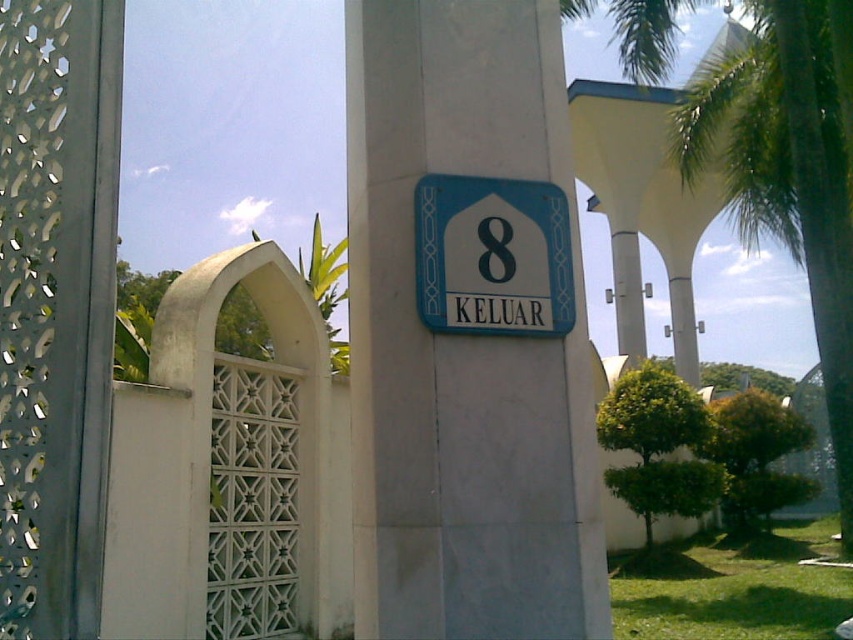
At what (x,y) coordinates should I click in order to perform the action: click on green leafy palm tree at right. Please return your answer as a coordinate pair (x, y). Looking at the image, I should click on (788, 180).

Is green leafy palm tree at right to the left of blue plastic sign at center from the viewer's perspective?

In fact, green leafy palm tree at right is to the right of blue plastic sign at center.

I want to click on green leafy palm tree at right, so click(x=788, y=180).

Is white smooth pillar at center positioned behind green leafy palm tree at right?

No, it is in front of green leafy palm tree at right.

From the picture: Can you confirm if white smooth pillar at center is thinner than green leafy palm tree at right?

No, white smooth pillar at center is not thinner than green leafy palm tree at right.

Which is behind, point (555, 3) or point (704, 96)?

Point (704, 96)

Where is `white smooth pillar at center`? Image resolution: width=853 pixels, height=640 pixels. white smooth pillar at center is located at coordinates coord(462,340).

Is white smooth pillar at center further to the viewer compared to blue plastic sign at center?

No, white smooth pillar at center is closer to the viewer.

Locate an element on the screen. Image resolution: width=853 pixels, height=640 pixels. white smooth pillar at center is located at coordinates (462, 340).